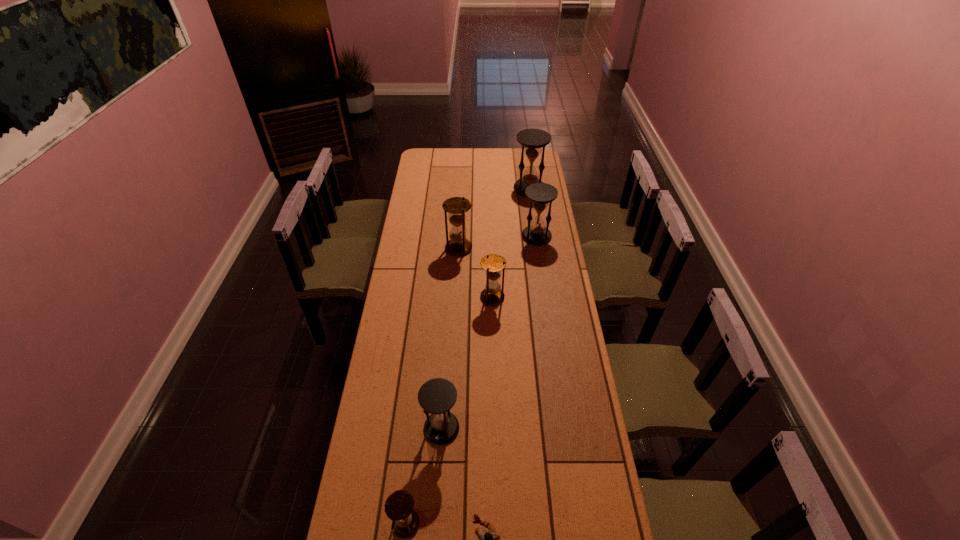
I want to click on the nearest brown hourglass, so click(x=399, y=505).

Identify the location of free location located on the left of the farthest object. (453, 188).

The width and height of the screenshot is (960, 540). Identify the location of vacant region located 0.210m on the left of the second farthest black hourglass. (481, 236).

Identify the location of vacant space situated on the right of the second brown hourglass from left to right. The width and height of the screenshot is (960, 540). (553, 248).

Locate an element on the screen. The image size is (960, 540). free space located on the left of the second nearest brown hourglass is located at coordinates pyautogui.click(x=465, y=297).

The height and width of the screenshot is (540, 960). What are the coordinates of `vacant space situated 0.150m on the left of the smallest black hourglass` in the screenshot? It's located at point(380,428).

At what (x,y) coordinates should I click in order to perform the action: click on vacant space located on the back of the smallest brown hourglass. Please return your answer as a coordinate pair (x, y). The image size is (960, 540). Looking at the image, I should click on (415, 442).

I want to click on object situated at the left edge, so click(399, 505).

This screenshot has width=960, height=540. I want to click on free point at the far edge, so click(459, 151).

The image size is (960, 540). I want to click on vacant region at the left edge of the desktop, so click(411, 258).